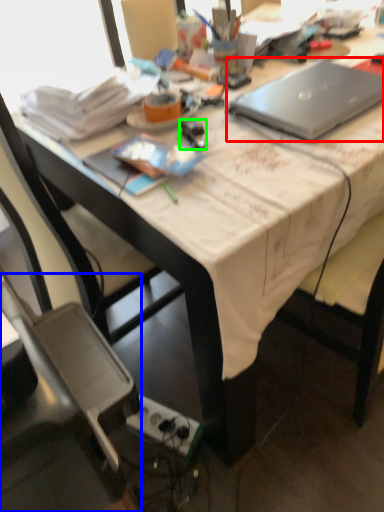
Question: Which is farther away from laptop (highlighted by a red box)? chair (highlighted by a blue box) or stationery (highlighted by a green box)?

Choices:
 (A) chair
 (B) stationery

Answer: (A)